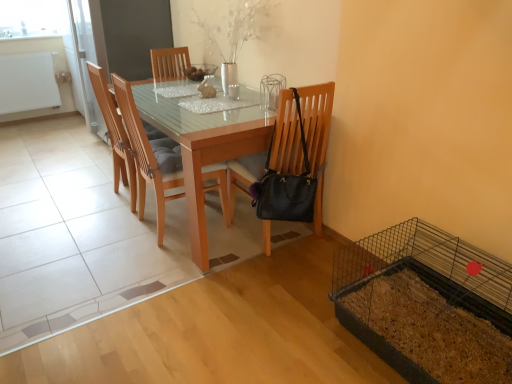
Question: Is wooden chair at center, marked as the 1th chair in a left-to-right arrangement, far from wooden chair at center, which ranks as the second chair in left-to-right order?

Choices:
 (A) no
 (B) yes

Answer: (A)

Question: Is wooden chair at center, marked as the 1th chair in a left-to-right arrangement, touching wooden chair at center, which ranks as the second chair in left-to-right order?

Choices:
 (A) yes
 (B) no

Answer: (B)

Question: Is wooden chair at center, marked as the 1th chair in a left-to-right arrangement, facing away from wooden chair at center, which ranks as the second chair in left-to-right order?

Choices:
 (A) yes
 (B) no

Answer: (B)

Question: Does wooden chair at center, which is counted as the 3th chair, starting from the right, have a greater width compared to wooden chair at center, acting as the second chair starting from the right?

Choices:
 (A) yes
 (B) no

Answer: (B)

Question: Can you confirm if wooden chair at center, which is counted as the 3th chair, starting from the right, is positioned to the left of wooden chair at center, acting as the second chair starting from the right?

Choices:
 (A) no
 (B) yes

Answer: (B)

Question: Is wooden chair at center, which ranks as the second chair in left-to-right order, surrounded by wooden chair at center, which is counted as the 3th chair, starting from the right?

Choices:
 (A) no
 (B) yes

Answer: (A)

Question: From the image's perspective, is wooden chair at center, which is counted as the 3th chair, starting from the right, on top of light brown wood table at center?

Choices:
 (A) no
 (B) yes

Answer: (B)

Question: Is wooden chair at center, which is counted as the 3th chair, starting from the right, taller than light brown wood table at center?

Choices:
 (A) no
 (B) yes

Answer: (B)

Question: From a real-world perspective, is wooden chair at center, marked as the 1th chair in a left-to-right arrangement, beneath light brown wood table at center?

Choices:
 (A) yes
 (B) no

Answer: (B)

Question: Can you confirm if wooden chair at center, marked as the 1th chair in a left-to-right arrangement, is positioned to the left of light brown wood table at center?

Choices:
 (A) yes
 (B) no

Answer: (A)

Question: Is wooden chair at center, which is counted as the 3th chair, starting from the right, turned away from light brown wood table at center?

Choices:
 (A) yes
 (B) no

Answer: (A)

Question: Is wooden chair at center, which is counted as the 3th chair, starting from the right, shorter than light brown wood table at center?

Choices:
 (A) no
 (B) yes

Answer: (A)

Question: Considering the relative sizes of wooden chair at center, acting as the second chair starting from the right, and black leather chair at center, acting as the 3th chair starting from the left, in the image provided, is wooden chair at center, acting as the second chair starting from the right, thinner than black leather chair at center, acting as the 3th chair starting from the left,?

Choices:
 (A) yes
 (B) no

Answer: (A)